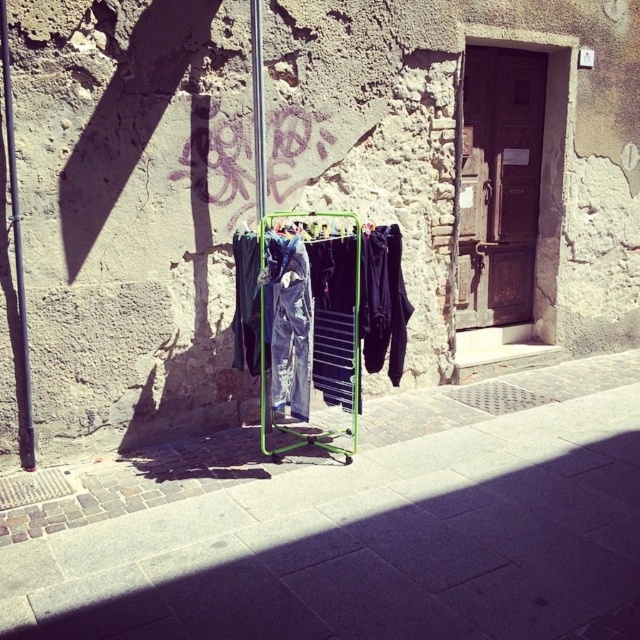
Question: Is smooth concrete pavement at center behind denim pants at center?

Choices:
 (A) yes
 (B) no

Answer: (B)

Question: Among these points, which one is nearest to the camera?

Choices:
 (A) (244, 310)
 (B) (4, 566)

Answer: (B)

Question: Which of the following is the farthest from the observer?

Choices:
 (A) smooth concrete pavement at center
 (B) denim pants at center

Answer: (B)

Question: Can you confirm if smooth concrete pavement at center is bigger than denim pants at center?

Choices:
 (A) yes
 (B) no

Answer: (A)

Question: Is smooth concrete pavement at center to the left of denim pants at center from the viewer's perspective?

Choices:
 (A) yes
 (B) no

Answer: (B)

Question: Which point is farther from the camera taking this photo?

Choices:
 (A) (307, 404)
 (B) (493, 465)

Answer: (B)